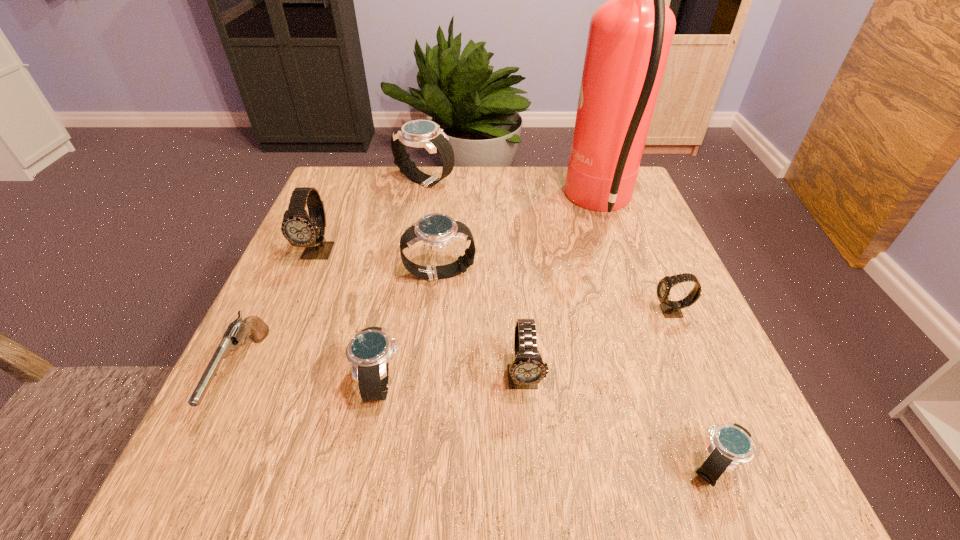
The width and height of the screenshot is (960, 540). Identify the location of the smallest gray watch. (671, 309).

Where is `the fifth nearest object`? The height and width of the screenshot is (540, 960). the fifth nearest object is located at coordinates (671, 309).

Identify the location of gun. Image resolution: width=960 pixels, height=540 pixels. (238, 330).

Find the location of a particular element. The image size is (960, 540). the smallest silver watch is located at coordinates (731, 444).

Locate an element on the screen. This screenshot has width=960, height=540. the nearest watch is located at coordinates (731, 444).

Find the location of a particular element. The image size is (960, 540). free space located 0.330m towards the nozzle of the fire extinguisher is located at coordinates pyautogui.click(x=437, y=204).

The image size is (960, 540). I want to click on vacant space located 0.070m towards the nozzle of the fire extinguisher, so click(540, 204).

Locate an element on the screen. This screenshot has height=540, width=960. free location located towards the nozzle of the fire extinguisher is located at coordinates (424, 204).

At what (x,y) coordinates should I click in order to perform the action: click on vacant point located 0.080m on the front of the farthest watch. Please return your answer as a coordinate pair (x, y). Looking at the image, I should click on (420, 212).

Locate an element on the screen. vacant area situated on the face of the farthest gray watch is located at coordinates (296, 308).